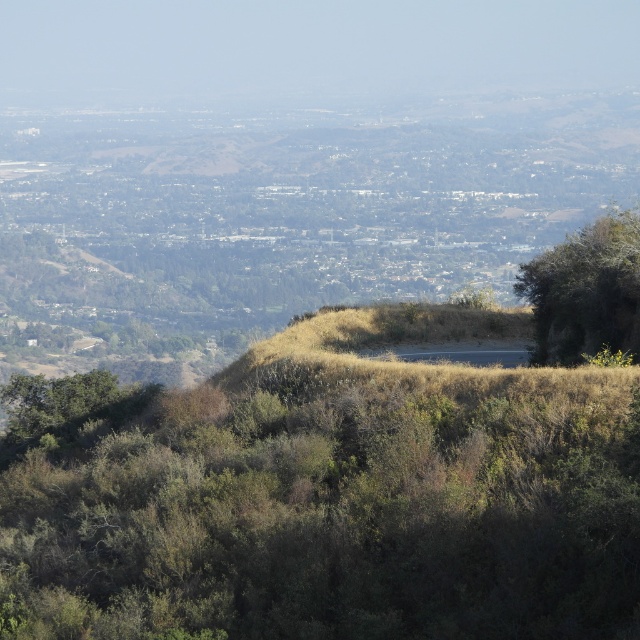
You are a hiker standing at the highest point of the hill, looking down at the landscape. You see the green leafy shrub at center and the green leafy tree at right. Which one is closer to you?

The green leafy shrub at center is closer to you because it is positioned in front of the green leafy tree at right.

You are a drone operator trying to map a hilly landscape. Your drone is currently at the center of the image and needs to capture a closeup of the green leafy shrub at center. According to the coordinates provided, in which direction should the drone move to reach the shrub?

The green leafy shrub at center is located at coordinates point (323, 506). Since the drone is at the center of the image, it should move towards the shrub by adjusting its position to match these coordinates, which would be slightly to the right and downward from the current position.